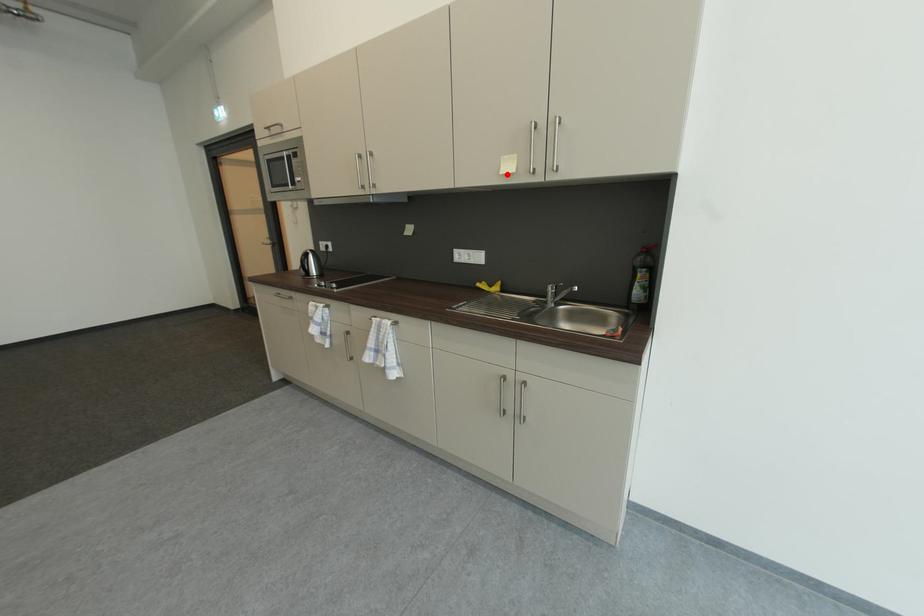
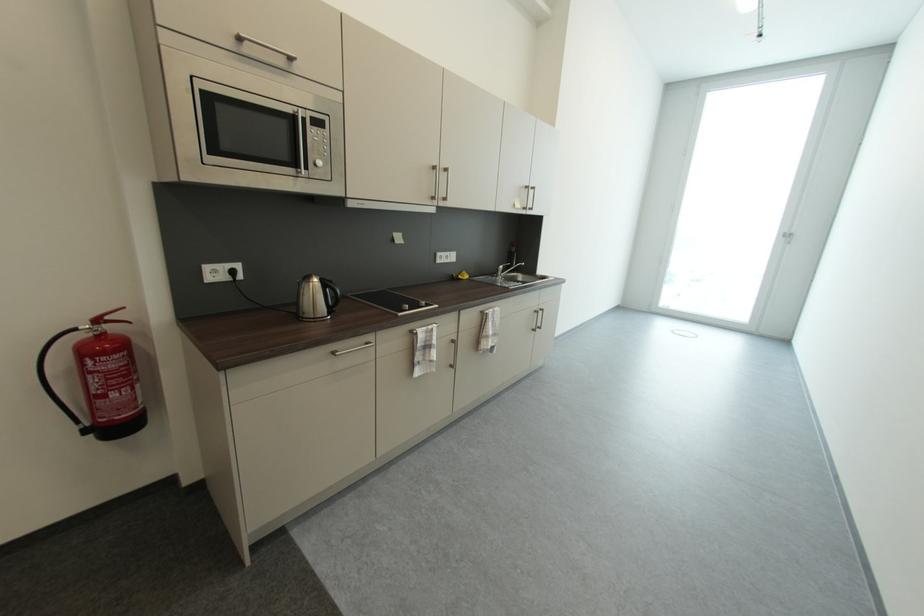
Question: I am providing you with two images of the same scene from different viewpoints. A red point is marked on the first image. Can you still see the location of the red point in image 2?

Choices:
 (A) Yes
 (B) No

Answer: (A)